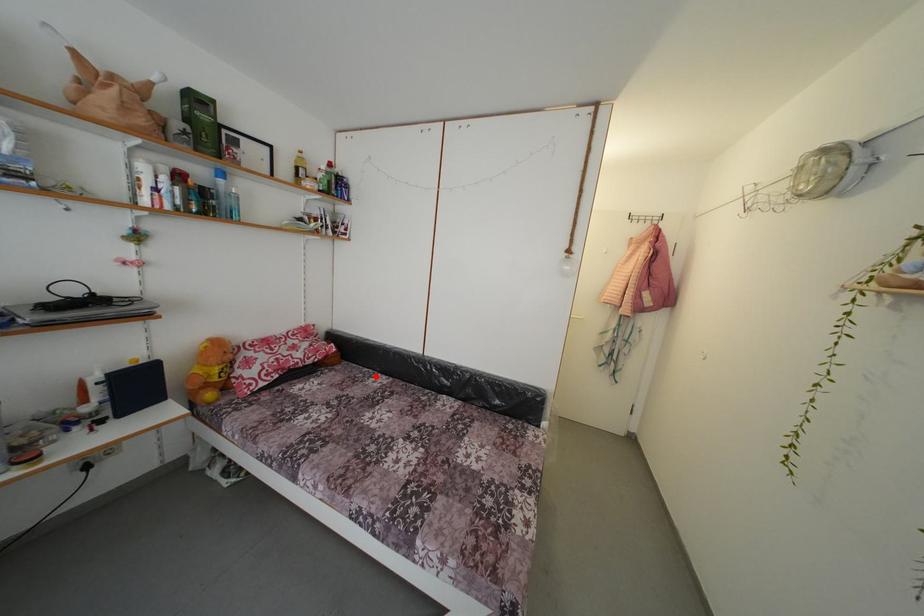
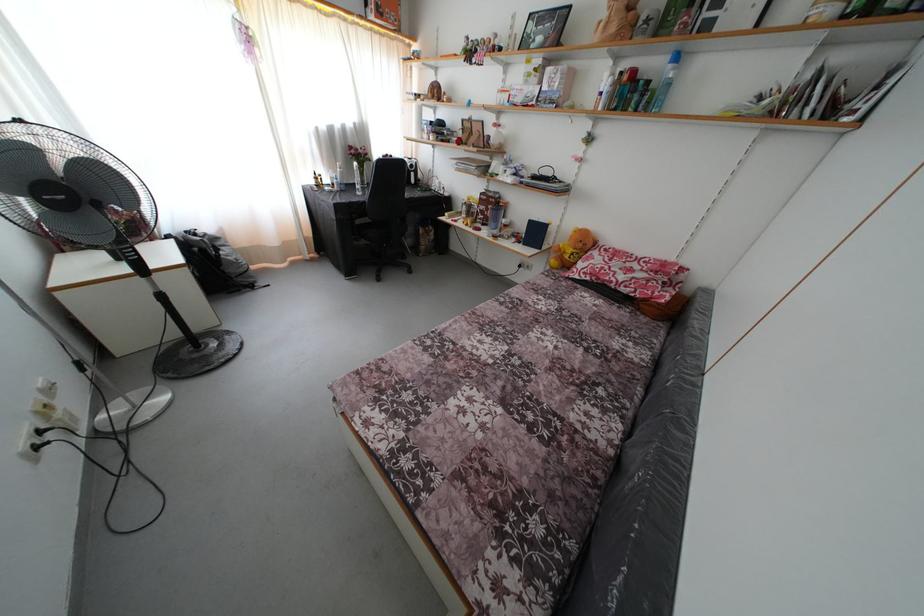
In the second image, find the point that corresponds to the highlighted location in the first image.

(663, 353)